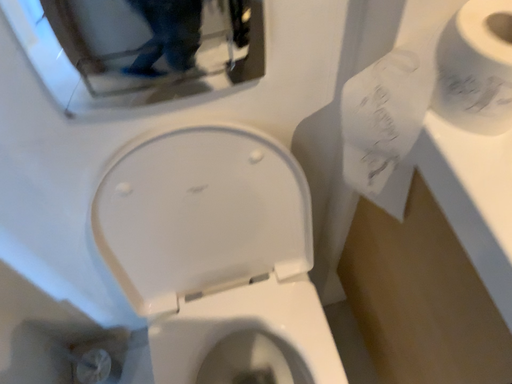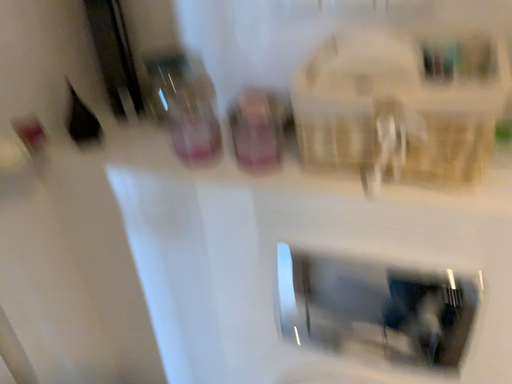
Question: Which way did the camera rotate in the video?

Choices:
 (A) rotated right
 (B) rotated left

Answer: (B)